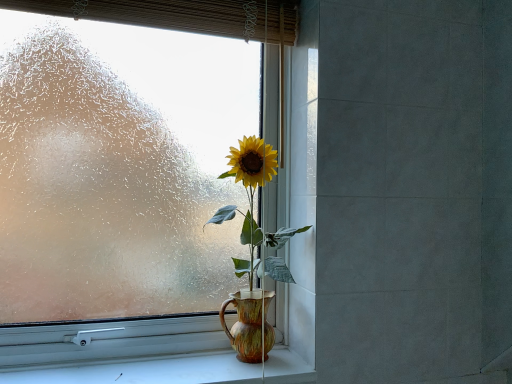
Find the location of `free space above frosted glass window at center (from a real-world perspective)`. free space above frosted glass window at center (from a real-world perspective) is located at coordinates (100, 24).